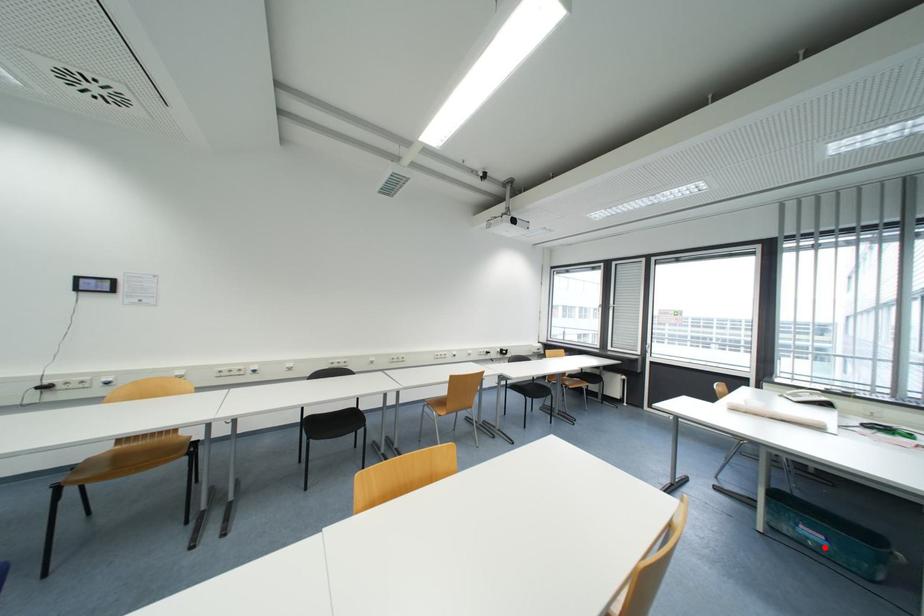
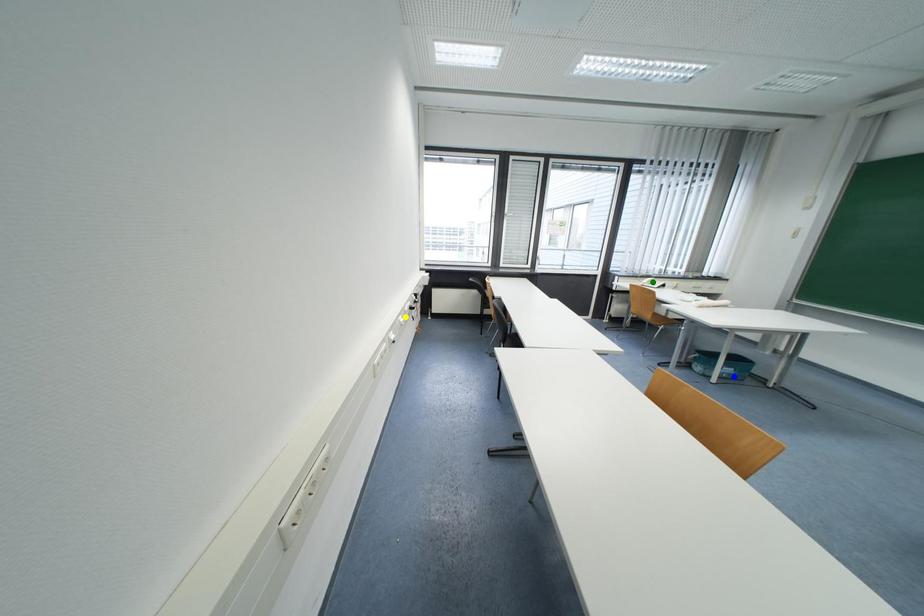
Question: I am providing you with two images of the same scene from different viewpoints. A red point is marked on the first image. You are given multiple points on the second image. Which point in image 2 is actually the same real-world point as the red point in image 1?

Choices:
 (A) blue point
 (B) green point
 (C) yellow point

Answer: (A)